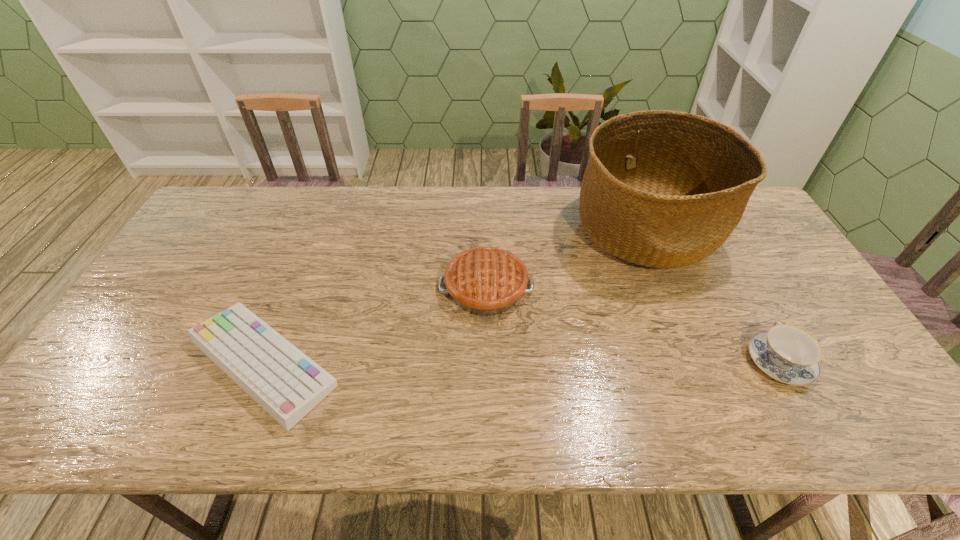
The height and width of the screenshot is (540, 960). What are the coordinates of `vacant area between the tallest object and the second object from left to right` in the screenshot? It's located at (565, 259).

This screenshot has width=960, height=540. I want to click on vacant area that lies between the second object from left to right and the shortest object, so click(x=374, y=326).

This screenshot has width=960, height=540. I want to click on unoccupied area between the chinaware and the second tallest object, so click(x=633, y=325).

The image size is (960, 540). Identify the location of vacant region between the tallest object and the pie. (565, 259).

Find the location of a particular element. The image size is (960, 540). unoccupied area between the shortest object and the chinaware is located at coordinates (521, 362).

In order to click on vacant point located between the computer keyboard and the third shortest object in this screenshot , I will do `click(374, 326)`.

Locate an element on the screen. The image size is (960, 540). vacant point located between the leftmost object and the third shortest object is located at coordinates click(374, 326).

Identify which object is the second closest to the computer keyboard. Please provide its 2D coordinates. Your answer should be formatted as a tuple, i.e. [(x, y)], where the tuple contains the x and y coordinates of a point satisfying the conditions above.

[(665, 189)]

Choose which object is the nearest neighbor to the chinaware. Please provide its 2D coordinates. Your answer should be formatted as a tuple, i.e. [(x, y)], where the tuple contains the x and y coordinates of a point satisfying the conditions above.

[(665, 189)]

Where is `vacant space that satisfies the following two spatial constraints: 1. on the back side of the tallest object; 2. on the left side of the computer keyboard`? The image size is (960, 540). vacant space that satisfies the following two spatial constraints: 1. on the back side of the tallest object; 2. on the left side of the computer keyboard is located at coordinates (317, 229).